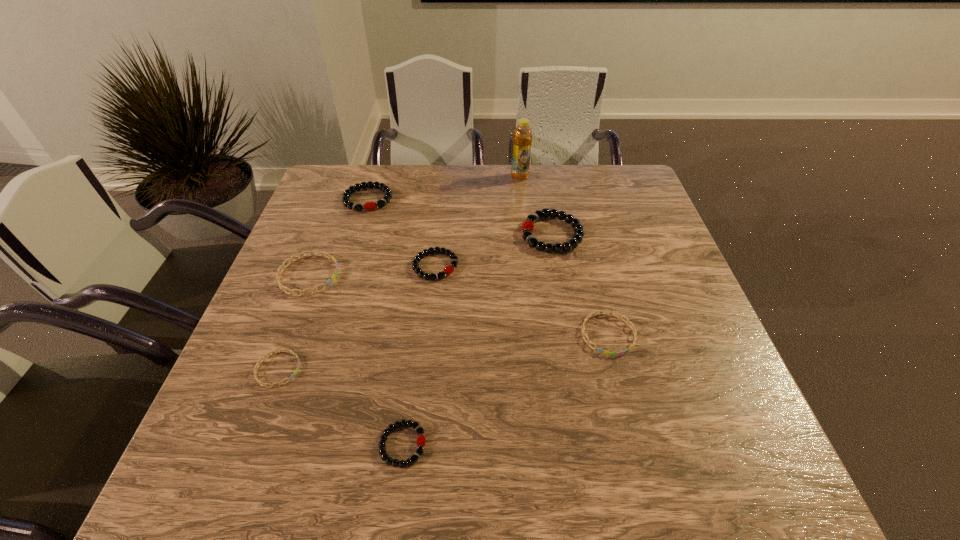
Image resolution: width=960 pixels, height=540 pixels. I want to click on vacant area at the far right corner, so click(596, 174).

The width and height of the screenshot is (960, 540). In the image, there is a desktop. Identify the location of free space at the near right corner. (685, 456).

Locate an element on the screen. empty space between the nearest bracelet and the farthest bracelet is located at coordinates (385, 322).

This screenshot has height=540, width=960. I want to click on vacant area between the farthest blue bracelet and the farthest object, so pos(414,226).

Where is `free point between the second biggest blue bracelet and the second farthest object`? The width and height of the screenshot is (960, 540). free point between the second biggest blue bracelet and the second farthest object is located at coordinates (489, 267).

Where is `free spot between the smallest black bracelet and the smallest blue bracelet`? Image resolution: width=960 pixels, height=540 pixels. free spot between the smallest black bracelet and the smallest blue bracelet is located at coordinates (340, 407).

This screenshot has width=960, height=540. In order to click on free space between the farthest blue bracelet and the bottle in this screenshot , I will do `click(414, 226)`.

Locate an element on the screen. This screenshot has height=540, width=960. vacant space that's between the smallest black bracelet and the second smallest blue bracelet is located at coordinates coord(505,389).

I want to click on vacant area that lies between the shortest bracelet and the nearest object, so click(340, 407).

This screenshot has height=540, width=960. I want to click on free space between the rightmost black bracelet and the biggest blue bracelet, so click(430, 255).